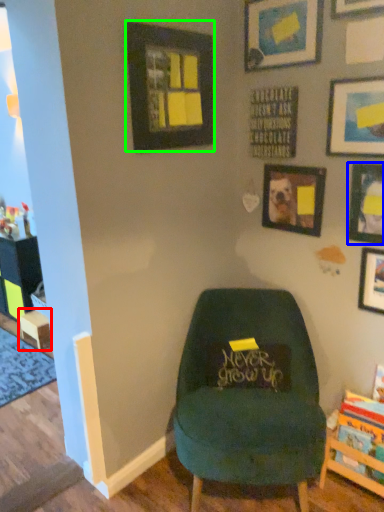
Question: Which object is positioned closest to table (highlighted by a red box)? Select from picture frame (highlighted by a blue box) and picture frame (highlighted by a green box).

Choices:
 (A) picture frame
 (B) picture frame

Answer: (B)